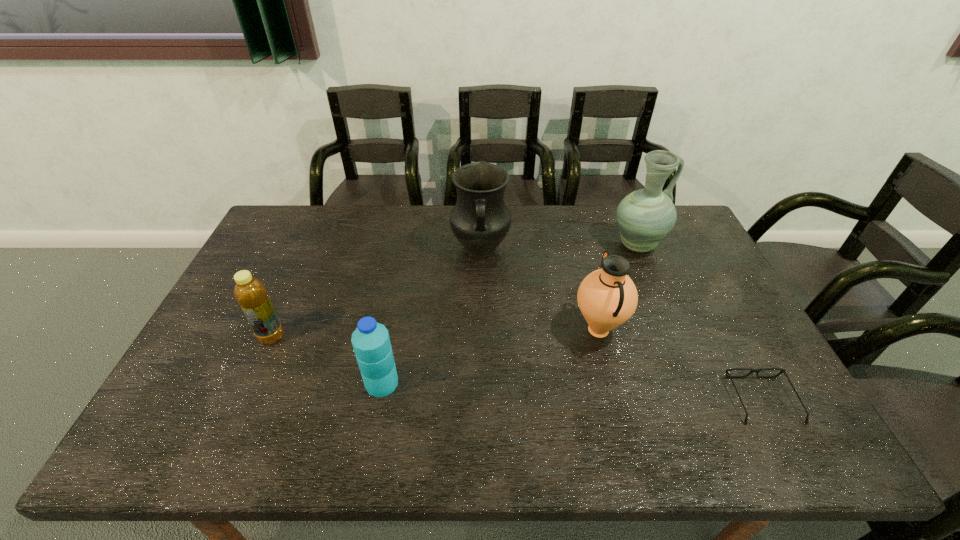
Find the location of a particular element. The image size is (960, 540). object present at the far right corner is located at coordinates (646, 216).

Image resolution: width=960 pixels, height=540 pixels. Find the location of `object that is at the near right corner`. object that is at the near right corner is located at coordinates (727, 371).

Locate an element on the screen. This screenshot has height=540, width=960. vacant position at the far edge of the desktop is located at coordinates (540, 227).

In the image, there is a desktop. At what (x,y) coordinates should I click in order to perform the action: click on free region at the near edge. Please return your answer as a coordinate pair (x, y). The image size is (960, 540). Looking at the image, I should click on (326, 448).

The height and width of the screenshot is (540, 960). What are the coordinates of `vacant region at the left edge of the desktop` in the screenshot? It's located at (270, 284).

You are a GUI agent. You are given a task and a screenshot of the screen. Output one action in this format:
    pyautogui.click(x=<x>, y=<y>)
    Task: Click on the blank area at the far left corner
    This screenshot has height=540, width=960.
    Given the screenshot: What is the action you would take?
    pyautogui.click(x=294, y=217)

Locate an element on the screen. unoccupied area between the leftmost pitcher and the spectacles is located at coordinates (621, 325).

Locate an element on the screen. The width and height of the screenshot is (960, 540). unoccupied position between the second object from left to right and the third object from right to left is located at coordinates (490, 356).

This screenshot has width=960, height=540. I want to click on free space between the bottle and the leftmost pitcher, so click(x=376, y=293).

This screenshot has width=960, height=540. I want to click on free space between the third object from left to right and the bottle, so click(376, 293).